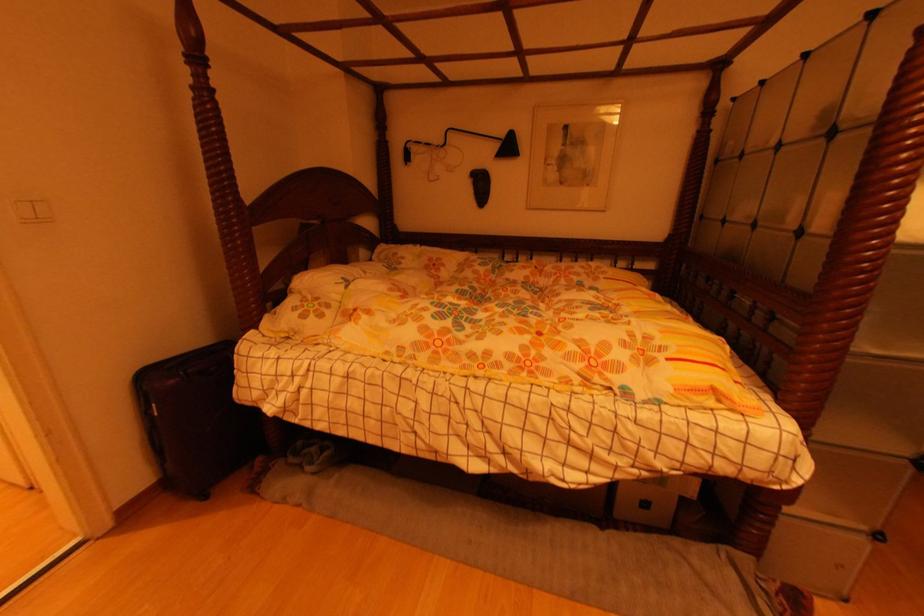
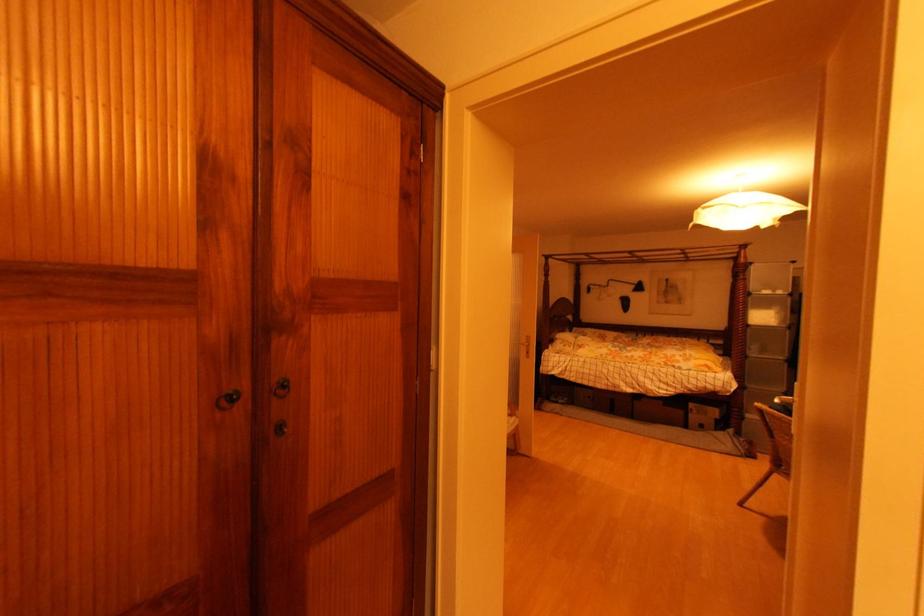
Question: In a continuous first-person perspective shot, in which direction is the camera moving?

Choices:
 (A) Left
 (B) Right
 (C) Forward
 (D) Backward

Answer: (D)